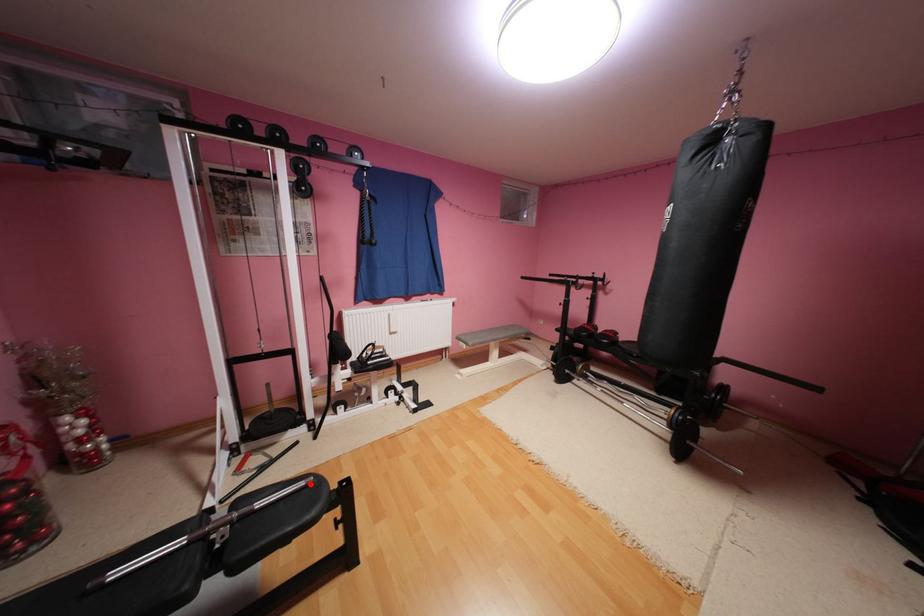
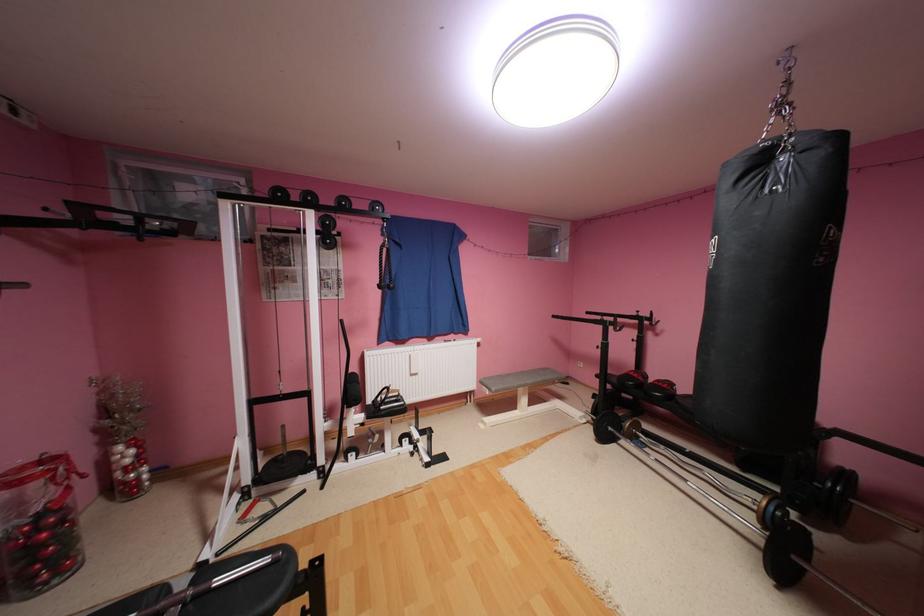
In the second image, find the point that corresponds to the highlighted location in the first image.

(276, 560)